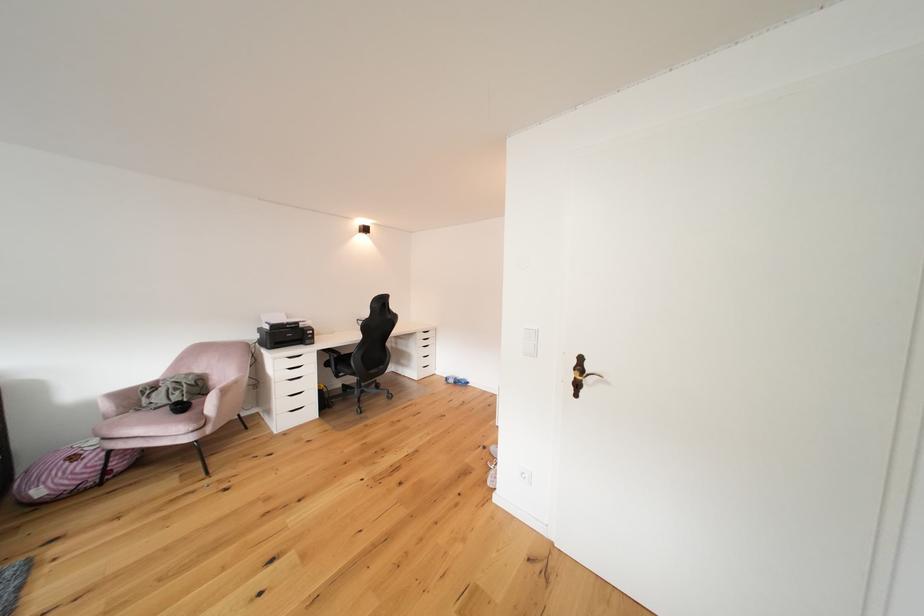
What do you see at coordinates (282, 322) in the screenshot? This screenshot has width=924, height=616. I see `the printer scanner lid` at bounding box center [282, 322].